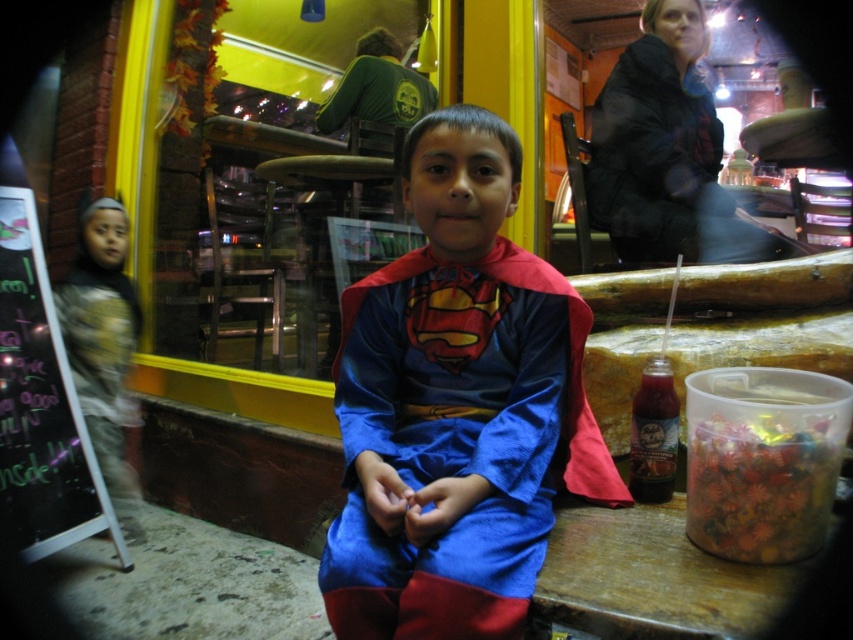
You are a photographer setting up for a night shoot in the described street scene. You have a camera bag that needs to be placed on either the wooden table at lower right or the translucent plastic container at lower right. Which surface can better support the bag without tipping over?

The wooden table at lower right has a lesser height compared to the translucent plastic container at lower right, so the translucent plastic container at lower right is taller and more stable for placing the camera bag to prevent tipping.

You are a costume designer trying to decide which costume item to place on a mannequin. The velvet blue cape at center and the black fuzzy robe at upper right are both options. Based on their sizes, which one would you choose if you want the item to cover more of the mannequin?

The black fuzzy robe at upper right should be chosen because its width is greater than the velvet blue cape at center, allowing it to cover more of the mannequin.